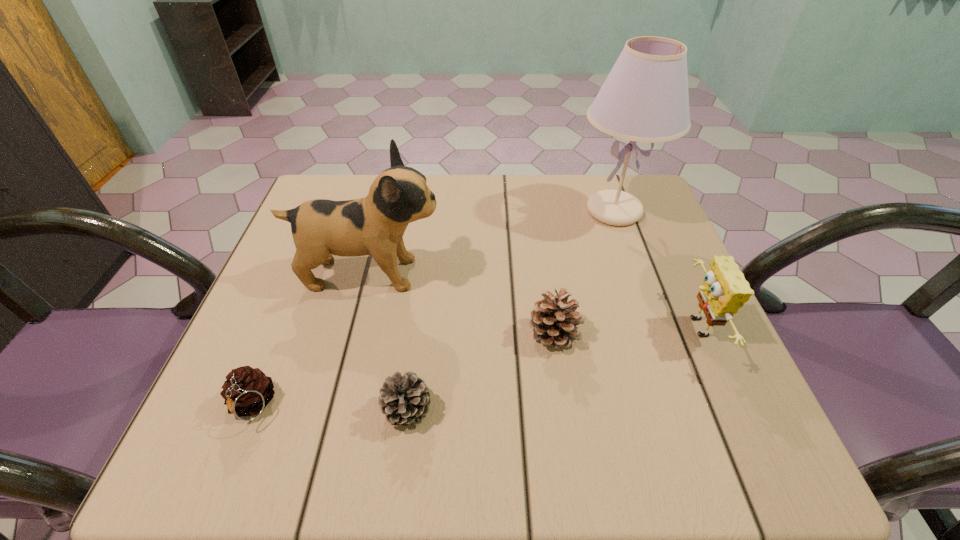
Find the location of a particular element. vacant space located on the face of the sponge is located at coordinates (584, 328).

Identify the location of free space located on the face of the sponge. Image resolution: width=960 pixels, height=540 pixels. (558, 328).

Locate an element on the screen. The height and width of the screenshot is (540, 960). vacant space located on the face of the sponge is located at coordinates (568, 328).

You are a GUI agent. You are given a task and a screenshot of the screen. Output one action in this format:
    pyautogui.click(x=<x>, y=<y>)
    Task: Click on the vacant region located 0.090m on the front of the third shortest object
    The height and width of the screenshot is (540, 960).
    Given the screenshot: What is the action you would take?
    pyautogui.click(x=564, y=399)

The width and height of the screenshot is (960, 540). Find the location of `free spot located on the right of the second pinecone from left to right`. free spot located on the right of the second pinecone from left to right is located at coordinates (479, 409).

Find the location of a particular element. The width and height of the screenshot is (960, 540). object that is at the far edge is located at coordinates (645, 98).

At what (x,y) coordinates should I click in order to perform the action: click on puppy at the left edge. Please return your answer as a coordinate pair (x, y). Image resolution: width=960 pixels, height=540 pixels. Looking at the image, I should click on (321, 228).

The height and width of the screenshot is (540, 960). I want to click on pinecone that is at the left edge, so click(247, 391).

Identify the location of lampshade that is positioned at the right edge. Image resolution: width=960 pixels, height=540 pixels. (645, 98).

At what (x,y) coordinates should I click in order to perform the action: click on sponge located in the right edge section of the desktop. Please return your answer as a coordinate pair (x, y). The height and width of the screenshot is (540, 960). Looking at the image, I should click on (724, 290).